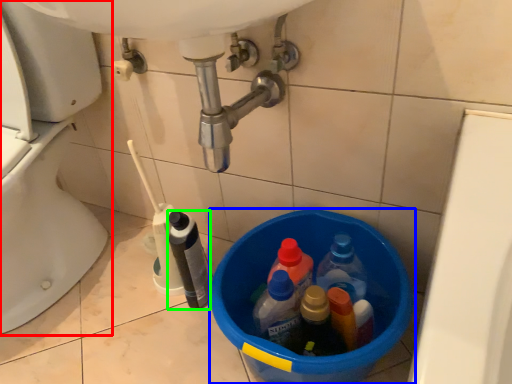
Question: Which is farther away from toilet (highlighted by a red box)? basin (highlighted by a blue box) or bottle (highlighted by a green box)?

Choices:
 (A) basin
 (B) bottle

Answer: (A)